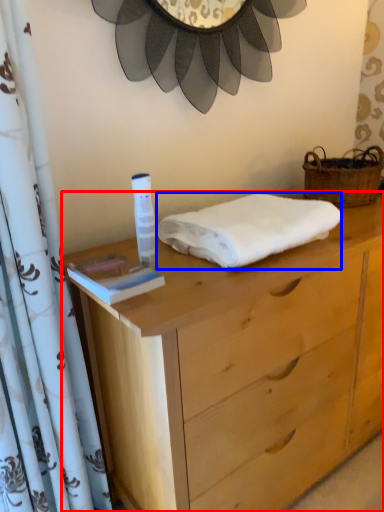
Question: Among these objects, which one is farthest to the camera, chest of drawers (highlighted by a red box) or towel (highlighted by a blue box)?

Choices:
 (A) chest of drawers
 (B) towel

Answer: (B)